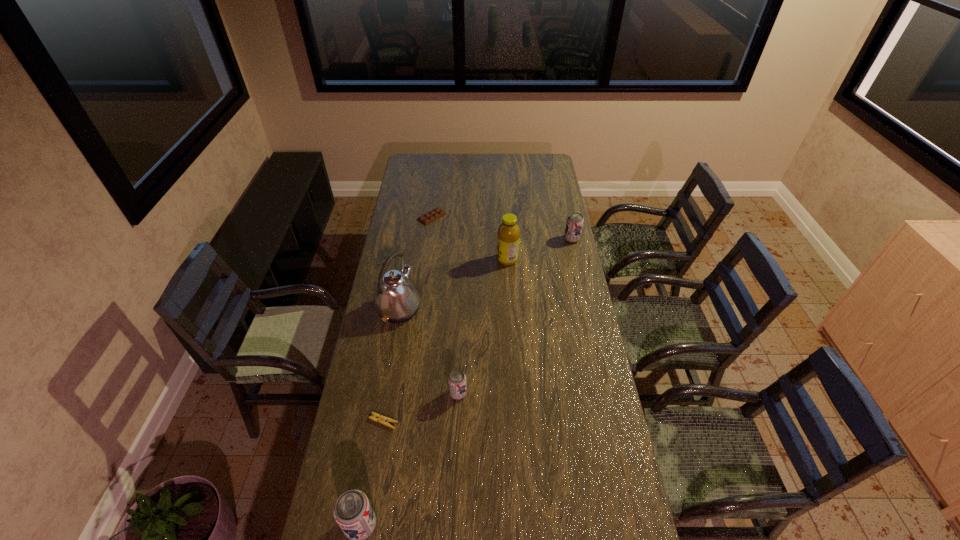
Where is `empty location between the second farthest beer can and the chocolate bar`? The image size is (960, 540). empty location between the second farthest beer can and the chocolate bar is located at coordinates (445, 305).

Where is `blank region between the tallest object and the rightmost beer can`? Image resolution: width=960 pixels, height=540 pixels. blank region between the tallest object and the rightmost beer can is located at coordinates (486, 274).

At what (x,y) coordinates should I click in order to perform the action: click on empty space that is in between the sixth shortest object and the fourth shortest object. Please return your answer as a coordinate pair (x, y). Looking at the image, I should click on (540, 249).

Where is `vacant region between the third object from right to left and the clothespin`? The width and height of the screenshot is (960, 540). vacant region between the third object from right to left and the clothespin is located at coordinates (420, 407).

The width and height of the screenshot is (960, 540). Identify the location of free space between the kettle and the second beer can from left to right. (429, 351).

The image size is (960, 540). Find the location of `empty space that is in between the fourth farthest object and the sixth farthest object`. empty space that is in between the fourth farthest object and the sixth farthest object is located at coordinates (392, 365).

Where is `object that ranks as the sixth closest to the rightmost object`? The image size is (960, 540). object that ranks as the sixth closest to the rightmost object is located at coordinates (352, 511).

Choose which object is the second nearest neighbor to the clothespin. Please provide its 2D coordinates. Your answer should be formatted as a tuple, i.e. [(x, y)], where the tuple contains the x and y coordinates of a point satisfying the conditions above.

[(352, 511)]

What are the coordinates of `beer can that is the nearest to the second nearest object` in the screenshot? It's located at (457, 379).

Find the location of a particular element. Image resolution: width=960 pixels, height=540 pixels. beer can that is the second closest to the fifth farthest object is located at coordinates (574, 224).